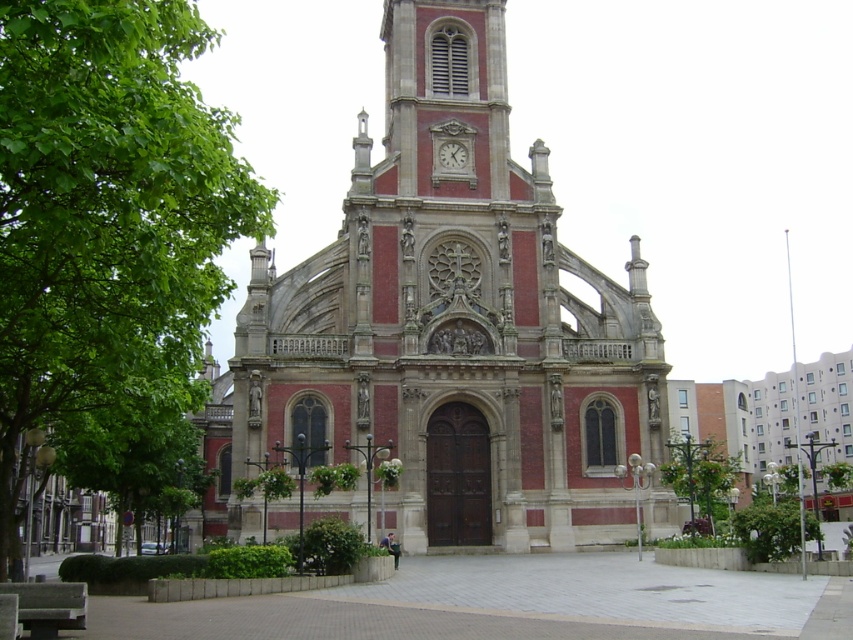
Question: Which object is the farthest from the white marble clock at upper center?

Choices:
 (A) green leafy tree at left
 (B) green leafy tree at center
 (C) red brick church at center

Answer: (A)

Question: Does red brick church at center appear on the left side of white marble clock at upper center?

Choices:
 (A) yes
 (B) no

Answer: (A)

Question: Considering the real-world distances, which object is farthest from the red brick church at center?

Choices:
 (A) white marble clock at upper center
 (B) green leafy tree at center
 (C) green leafy tree at left

Answer: (C)

Question: Which is nearer to the red brick church at center?

Choices:
 (A) white marble clock at upper center
 (B) green leafy tree at center

Answer: (B)

Question: Does red brick church at center come behind green leafy tree at left?

Choices:
 (A) yes
 (B) no

Answer: (A)

Question: Is red brick church at center thinner than green leafy tree at left?

Choices:
 (A) yes
 (B) no

Answer: (B)